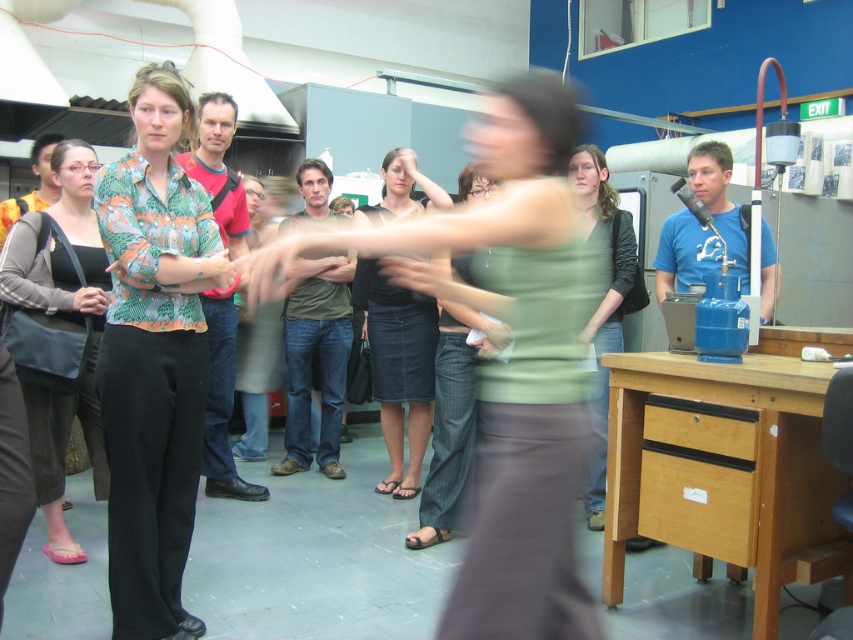
Question: Which object appears closest to the camera in this image?

Choices:
 (A) green matte shirt at center
 (B) green denim skirt at center
 (C) green matte tank top at center

Answer: (C)

Question: Is matte black tank top at center bigger than green denim skirt at center?

Choices:
 (A) yes
 (B) no

Answer: (B)

Question: Can you confirm if matte black tank top at center is positioned below denim skirt at center?

Choices:
 (A) yes
 (B) no

Answer: (A)

Question: Does matte black tank top at center appear over denim skirt at center?

Choices:
 (A) no
 (B) yes

Answer: (A)

Question: Which object is the closest to the denim skirt at center?

Choices:
 (A) green matte tank top at center
 (B) printed fabric blouse at center

Answer: (B)

Question: Which object is the closest to the green matte tank top at center?

Choices:
 (A) green matte shirt at center
 (B) matte black tank top at center
 (C) green denim skirt at center

Answer: (C)